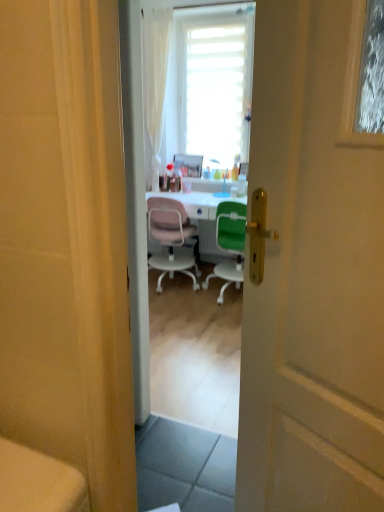
Question: Is wooden picture frame at center inside pink plastic chair at center, positioned as the first chair in left-to-right order?

Choices:
 (A) no
 (B) yes

Answer: (A)

Question: Does pink plastic chair at center, which ranks as the second chair in right-to-left order, have a larger size compared to wooden picture frame at center?

Choices:
 (A) no
 (B) yes

Answer: (B)

Question: Is pink plastic chair at center, positioned as the first chair in left-to-right order, not within wooden picture frame at center?

Choices:
 (A) no
 (B) yes

Answer: (B)

Question: Is pink plastic chair at center, which ranks as the second chair in right-to-left order, positioned behind wooden picture frame at center?

Choices:
 (A) no
 (B) yes

Answer: (A)

Question: Does pink plastic chair at center, which ranks as the second chair in right-to-left order, have a lesser height compared to wooden picture frame at center?

Choices:
 (A) no
 (B) yes

Answer: (A)

Question: Is white glossy desk at center inside or outside of pink plastic chair at center, positioned as the first chair in left-to-right order?

Choices:
 (A) outside
 (B) inside

Answer: (A)

Question: From a real-world perspective, relative to pink plastic chair at center, positioned as the first chair in left-to-right order, is white glossy desk at center vertically above or below?

Choices:
 (A) above
 (B) below

Answer: (B)

Question: From the image's perspective, relative to pink plastic chair at center, which ranks as the second chair in right-to-left order, is white glossy desk at center above or below?

Choices:
 (A) below
 (B) above

Answer: (B)

Question: Is white glossy desk at center to the left or to the right of pink plastic chair at center, positioned as the first chair in left-to-right order, in the image?

Choices:
 (A) right
 (B) left

Answer: (A)

Question: Is white glossy desk at center taller or shorter than wooden picture frame at center?

Choices:
 (A) tall
 (B) short

Answer: (A)

Question: Is point (193, 218) closer or farther from the camera than point (173, 160)?

Choices:
 (A) closer
 (B) farther

Answer: (A)

Question: From a real-world perspective, relative to wooden picture frame at center, is white glossy desk at center vertically above or below?

Choices:
 (A) below
 (B) above

Answer: (A)

Question: Visually, is white glossy desk at center positioned to the left or to the right of wooden picture frame at center?

Choices:
 (A) right
 (B) left

Answer: (A)

Question: Is white matte door at center taller or shorter than wooden picture frame at center?

Choices:
 (A) short
 (B) tall

Answer: (B)

Question: Would you say white matte door at center is inside or outside wooden picture frame at center?

Choices:
 (A) inside
 (B) outside

Answer: (B)